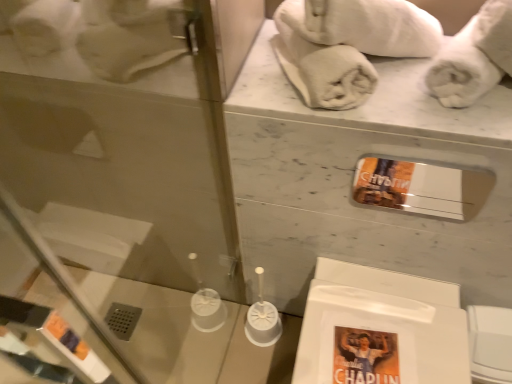
Question: Does white fluffy towel at upper right, acting as the first bath towel starting from the right, have a greater height compared to white cotton towel at upper center, the 3th bath towel positioned from the right?

Choices:
 (A) no
 (B) yes

Answer: (A)

Question: Is white fluffy towel at upper right, arranged as the 3th bath towel when viewed from the left, not near white cotton towel at upper center, which is the 1th bath towel in left-to-right order?

Choices:
 (A) no
 (B) yes

Answer: (A)

Question: Is white fluffy towel at upper right, acting as the first bath towel starting from the right, next to white cotton towel at upper center, the 3th bath towel positioned from the right, and touching it?

Choices:
 (A) no
 (B) yes

Answer: (A)

Question: Is white fluffy towel at upper right, acting as the first bath towel starting from the right, to the right of white cotton towel at upper center, the 3th bath towel positioned from the right, from the viewer's perspective?

Choices:
 (A) no
 (B) yes

Answer: (B)

Question: Can you confirm if white fluffy towel at upper right, arranged as the 3th bath towel when viewed from the left, is wider than white cotton towel at upper center, which is the 1th bath towel in left-to-right order?

Choices:
 (A) yes
 (B) no

Answer: (B)

Question: Considering their positions, is white soft towel at upper right, the second bath towel when ordered from left to right, located in front of or behind white fluffy towel at upper right, arranged as the 3th bath towel when viewed from the left?

Choices:
 (A) behind
 (B) front

Answer: (B)

Question: From a real-world perspective, is white soft towel at upper right, the second bath towel in the right-to-left sequence, above or below white fluffy towel at upper right, arranged as the 3th bath towel when viewed from the left?

Choices:
 (A) below
 (B) above

Answer: (B)

Question: Is white soft towel at upper right, the second bath towel in the right-to-left sequence, bigger or smaller than white fluffy towel at upper right, arranged as the 3th bath towel when viewed from the left?

Choices:
 (A) big
 (B) small

Answer: (A)

Question: From the image's perspective, is white soft towel at upper right, the second bath towel in the right-to-left sequence, above or below white fluffy towel at upper right, acting as the first bath towel starting from the right?

Choices:
 (A) below
 (B) above

Answer: (B)

Question: In the image, is white fluffy towel at upper right, acting as the first bath towel starting from the right, on the left side or the right side of transparent glass door at left?

Choices:
 (A) right
 (B) left

Answer: (A)

Question: Choose the correct answer: Is white fluffy towel at upper right, arranged as the 3th bath towel when viewed from the left, inside transparent glass door at left or outside it?

Choices:
 (A) outside
 (B) inside

Answer: (A)

Question: From a real-world perspective, relative to transparent glass door at left, is white fluffy towel at upper right, arranged as the 3th bath towel when viewed from the left, vertically above or below?

Choices:
 (A) above
 (B) below

Answer: (A)

Question: From the image's perspective, is white fluffy towel at upper right, acting as the first bath towel starting from the right, above or below transparent glass door at left?

Choices:
 (A) below
 (B) above

Answer: (B)

Question: Which is correct: transparent glass door at left is inside white fluffy towel at upper right, acting as the first bath towel starting from the right, or outside of it?

Choices:
 (A) outside
 (B) inside

Answer: (A)

Question: Relative to white fluffy towel at upper right, arranged as the 3th bath towel when viewed from the left, is transparent glass door at left in front or behind?

Choices:
 (A) front
 (B) behind

Answer: (A)